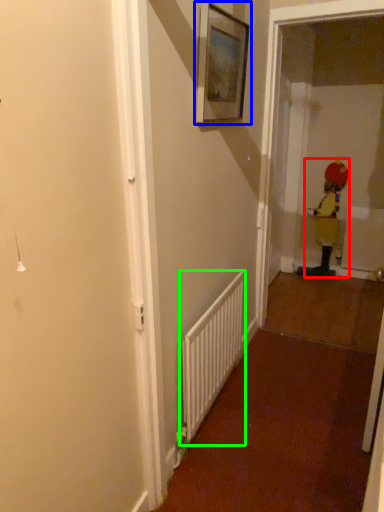
Question: Which is nearer to the toddler (highlighted by a red box)? picture frame (highlighted by a blue box) or radiator (highlighted by a green box).

Choices:
 (A) picture frame
 (B) radiator

Answer: (B)